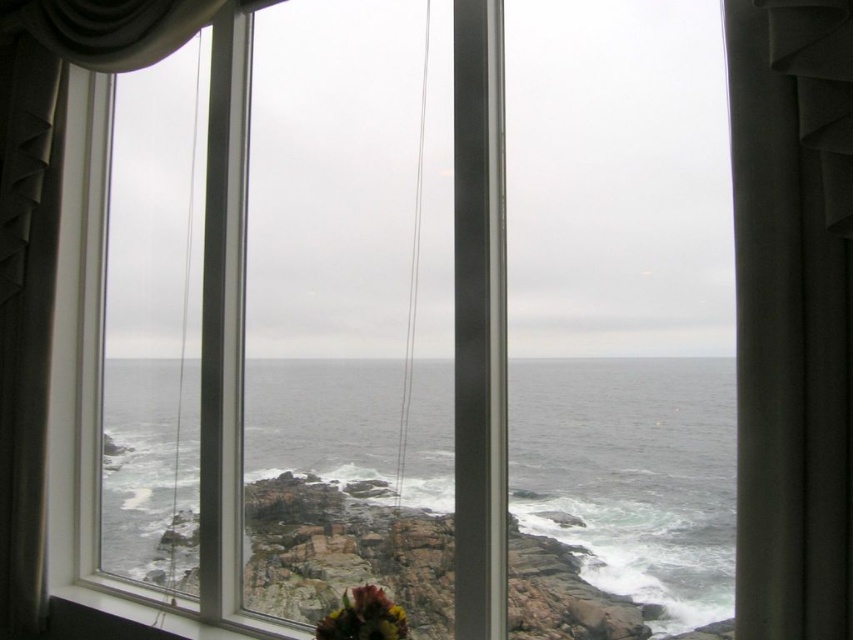
Is satin fabric curtain at left taller than multicolored fabric flower at bottom center?

Correct, satin fabric curtain at left is much taller as multicolored fabric flower at bottom center.

Does point (184, 8) come closer to viewer compared to point (381, 636)?

That is False.

Which is in front, point (178, 13) or point (390, 621)?

Point (390, 621)

Locate an element on the screen. Image resolution: width=853 pixels, height=640 pixels. satin fabric curtain at left is located at coordinates (47, 237).

Which is below, gray matte water at center or satin fabric curtain at left?

gray matte water at center is below.

Which is above, gray matte water at center or satin fabric curtain at left?

satin fabric curtain at left is higher up.

Which is in front, point (561, 518) or point (160, 16)?

Point (561, 518) is in front.

The height and width of the screenshot is (640, 853). I want to click on gray matte water at center, so click(x=619, y=493).

What do you see at coordinates (619, 493) in the screenshot?
I see `gray matte water at center` at bounding box center [619, 493].

Between gray matte water at center and multicolored fabric flower at bottom center, which one has less height?

Standing shorter between the two is multicolored fabric flower at bottom center.

Does point (273, 374) come closer to viewer compared to point (399, 632)?

No.

I want to click on gray matte water at center, so click(x=619, y=493).